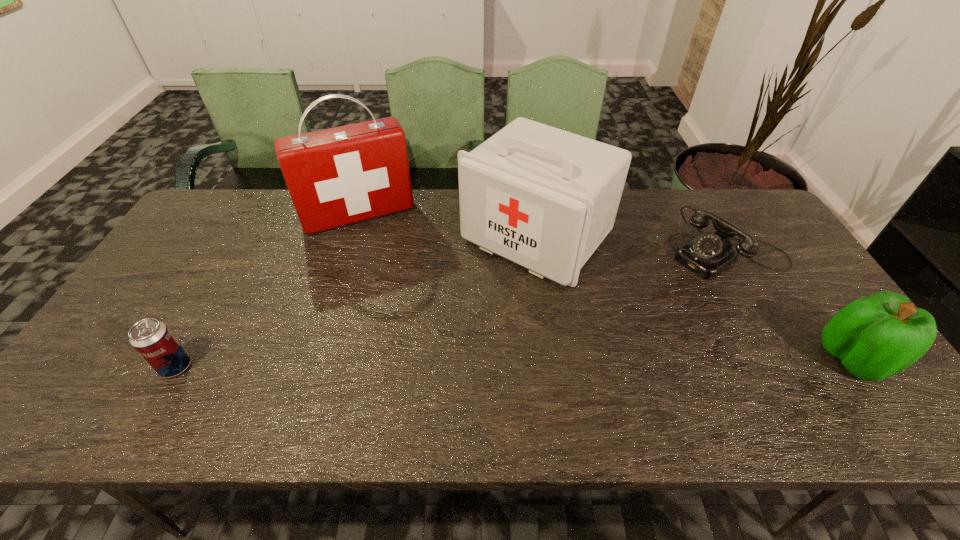
This screenshot has height=540, width=960. What are the coordinates of `free space between the left first-aid kit and the right first-aid kit` in the screenshot? It's located at (447, 226).

Identify the location of unoccupied position between the third object from right to left and the beer can. (356, 301).

The image size is (960, 540). I want to click on empty space between the telephone and the beer can, so click(x=451, y=309).

In order to click on free point between the third object from right to left and the telephone in this screenshot , I will do `click(632, 244)`.

Where is `blank region between the fourth object from right to left and the right first-aid kit`? This screenshot has width=960, height=540. blank region between the fourth object from right to left and the right first-aid kit is located at coordinates (447, 226).

Identify the location of free spot between the fourth object from right to left and the right first-aid kit. (447, 226).

The image size is (960, 540). I want to click on vacant space that is in between the right first-aid kit and the third shortest object, so click(x=695, y=298).

Locate which object is the second closest to the beer can. Please provide its 2D coordinates. Your answer should be formatted as a tuple, i.e. [(x, y)], where the tuple contains the x and y coordinates of a point satisfying the conditions above.

[(544, 198)]

You are a GUI agent. You are given a task and a screenshot of the screen. Output one action in this format:
    pyautogui.click(x=<x>, y=<y>)
    Task: Click on the object that is the third closest to the right first-aid kit
    
    Given the screenshot: What is the action you would take?
    pyautogui.click(x=875, y=337)

Locate an element on the screen. The image size is (960, 540). vacant region that satisfies the following two spatial constraints: 1. on the front side of the shortest object; 2. on the right side of the right first-aid kit is located at coordinates (539, 251).